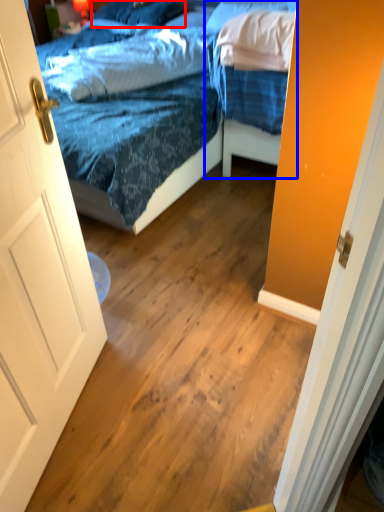
Question: Among these objects, which one is nearest to the camera, pillow (highlighted by a red box) or bed (highlighted by a blue box)?

Choices:
 (A) pillow
 (B) bed

Answer: (B)